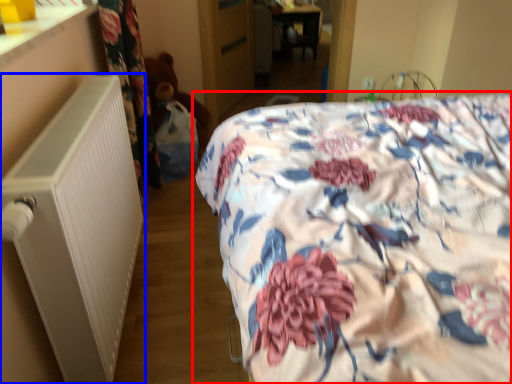
Question: Which object appears closest to the camera in this image, bed (highlighted by a red box) or radiator (highlighted by a blue box)?

Choices:
 (A) bed
 (B) radiator

Answer: (A)